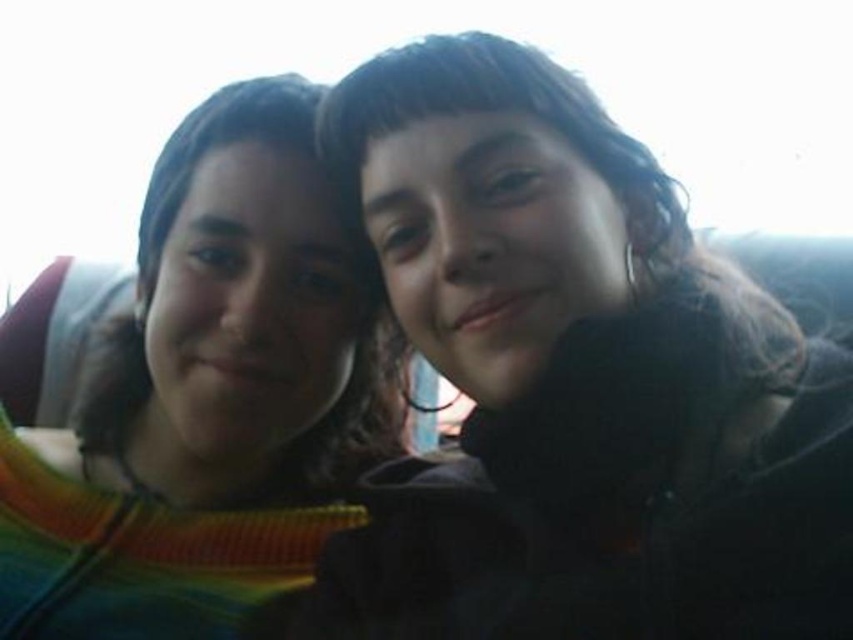
Question: Can you confirm if matte black jacket at center is positioned above rainbow striped sweater at left?

Choices:
 (A) yes
 (B) no

Answer: (A)

Question: Which object appears closest to the camera in this image?

Choices:
 (A) matte black jacket at center
 (B) rainbow striped sweater at left

Answer: (A)

Question: Which point is closer to the camera?

Choices:
 (A) (402, 64)
 (B) (280, 288)

Answer: (A)

Question: Does matte black jacket at center have a smaller size compared to rainbow striped sweater at left?

Choices:
 (A) no
 (B) yes

Answer: (B)

Question: Which point is farther to the camera?

Choices:
 (A) (427, 538)
 (B) (68, 541)

Answer: (B)

Question: Is matte black jacket at center to the right of rainbow striped sweater at left from the viewer's perspective?

Choices:
 (A) no
 (B) yes

Answer: (B)